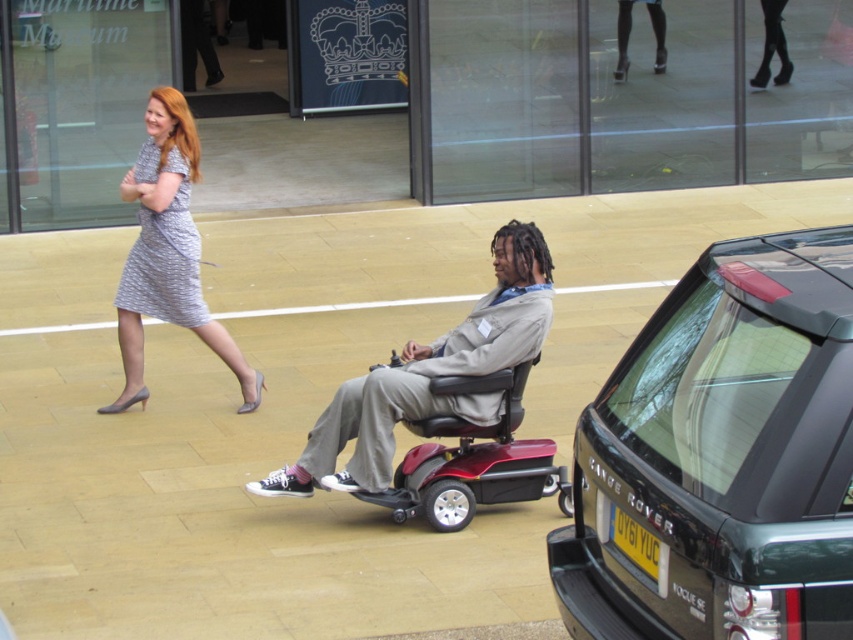
Does gray fabric wheelchair at center appear under yellow matte license plate at lower right?

No.

Measure the distance between gray fabric wheelchair at center and yellow matte license plate at lower right.

They are 7.47 feet apart.

Locate an element on the screen. The width and height of the screenshot is (853, 640). gray fabric wheelchair at center is located at coordinates (428, 376).

Locate an element on the screen. The height and width of the screenshot is (640, 853). gray fabric wheelchair at center is located at coordinates (428, 376).

Is gray fabric wheelchair at center closer to camera compared to metallic red mobility scooter at center?

Yes, it is.

Does gray fabric wheelchair at center appear on the right side of metallic red mobility scooter at center?

Incorrect, gray fabric wheelchair at center is not on the right side of metallic red mobility scooter at center.

The height and width of the screenshot is (640, 853). Find the location of `gray fabric wheelchair at center`. gray fabric wheelchair at center is located at coordinates (428, 376).

Locate an element on the screen. The image size is (853, 640). gray fabric wheelchair at center is located at coordinates (428, 376).

Is dark gray metallic range rover at center right below gray fabric wheelchair at center?

Correct, dark gray metallic range rover at center right is located below gray fabric wheelchair at center.

From the picture: Between dark gray metallic range rover at center right and gray fabric wheelchair at center, which one is positioned higher?

gray fabric wheelchair at center is above.

Which is behind, point (836, 472) or point (428, 394)?

The point (428, 394) is behind.

Find the location of a particular element. The image size is (853, 640). dark gray metallic range rover at center right is located at coordinates (723, 456).